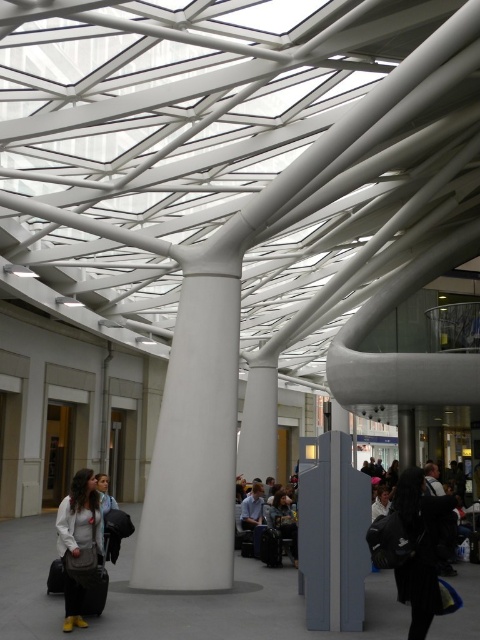
Question: Which point appears farthest from the camera in this image?

Choices:
 (A) (371, 554)
 (B) (86, 506)
 (C) (277, 493)

Answer: (C)

Question: Can you confirm if black fuzzy coat at lower right is wider than matte white jacket at lower left?

Choices:
 (A) no
 (B) yes

Answer: (B)

Question: Is black fuzzy coat at lower right behind dark brown leather jacket at center?

Choices:
 (A) no
 (B) yes

Answer: (A)

Question: Does black fuzzy coat at lower right appear on the right side of dark brown leather jacket at center?

Choices:
 (A) yes
 (B) no

Answer: (A)

Question: Which is nearer to the matte white jacket at lower left?

Choices:
 (A) dark brown leather jacket at center
 (B) black fuzzy coat at lower right

Answer: (B)

Question: Among these objects, which one is farthest from the camera?

Choices:
 (A) dark brown leather jacket at center
 (B) black fuzzy coat at lower right
 (C) matte white jacket at lower left

Answer: (A)